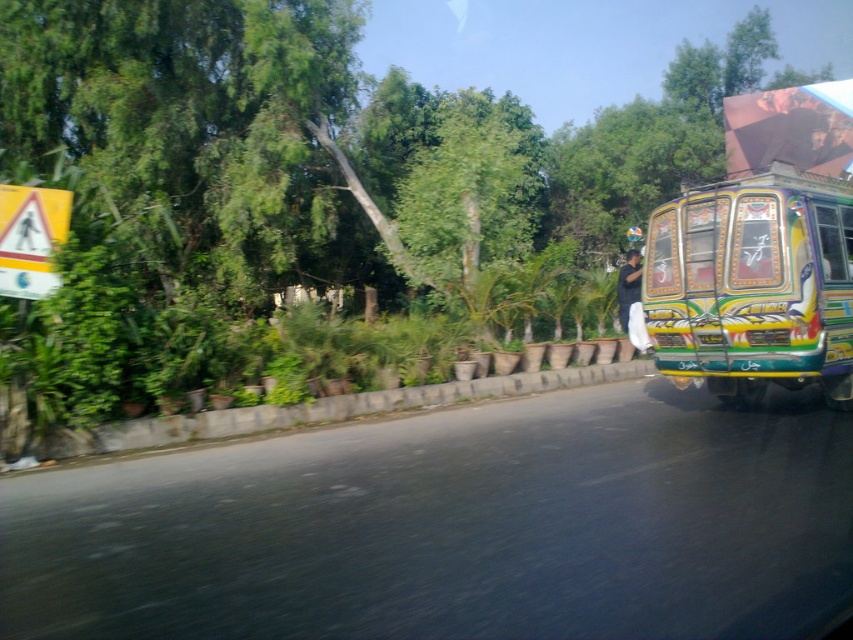
Question: Can you confirm if decorative painted bus at right is positioned above black fabric man at right?

Choices:
 (A) no
 (B) yes

Answer: (A)

Question: Which point appears farthest from the camera in this image?

Choices:
 (A) (788, 330)
 (B) (625, 314)

Answer: (B)

Question: Is decorative painted bus at right to the right of black fabric man at right from the viewer's perspective?

Choices:
 (A) yes
 (B) no

Answer: (A)

Question: Can you confirm if decorative painted bus at right is smaller than black fabric man at right?

Choices:
 (A) no
 (B) yes

Answer: (A)

Question: Among these objects, which one is nearest to the camera?

Choices:
 (A) black fabric man at right
 (B) decorative painted bus at right

Answer: (B)